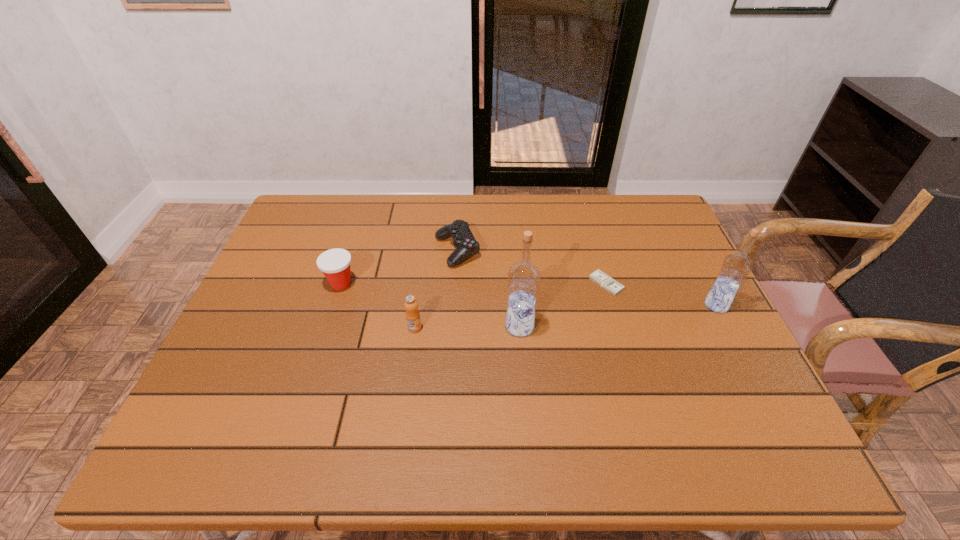
Identify the location of vacant space that is in between the third tallest object and the third object from left to right. The height and width of the screenshot is (540, 960). (x=436, y=289).

This screenshot has width=960, height=540. In order to click on vacant area between the tallest object and the shortest object in this screenshot , I will do pos(563,305).

I want to click on vacant area between the money and the third object from right to left, so click(563, 305).

The height and width of the screenshot is (540, 960). Identify the location of free space between the third object from left to right and the left vodka. (489, 288).

At what (x,y) coordinates should I click in order to perform the action: click on free spot between the farthest object and the nearer vodka. Please return your answer as a coordinate pair (x, y). Looking at the image, I should click on (489, 288).

I want to click on object identified as the fifth closest to the money, so click(335, 263).

At what (x,y) coordinates should I click in order to perform the action: click on object that is the fourth closest to the money. Please return your answer as a coordinate pair (x, y). Image resolution: width=960 pixels, height=540 pixels. Looking at the image, I should click on (412, 314).

You are a GUI agent. You are given a task and a screenshot of the screen. Output one action in this format:
    pyautogui.click(x=<x>, y=<y>)
    Task: Click on the free space that satisfies the following two spatial constraints: 1. on the back side of the tallest object; 2. on the left side of the money
    The height and width of the screenshot is (540, 960).
    Given the screenshot: What is the action you would take?
    pyautogui.click(x=516, y=284)

Locate an element on the screen. The width and height of the screenshot is (960, 540). free spot that satisfies the following two spatial constraints: 1. on the front side of the fourth object from left to right; 2. on the right side of the fourth tallest object is located at coordinates (327, 326).